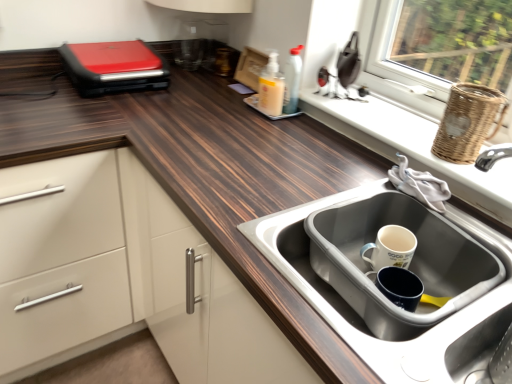
At what (x,y) coordinates should I click in order to perform the action: click on empty space that is ontop of red matte sandwich maker at upper left (from a real-world perspective). Please return your answer as a coordinate pair (x, y). Looking at the image, I should click on (106, 47).